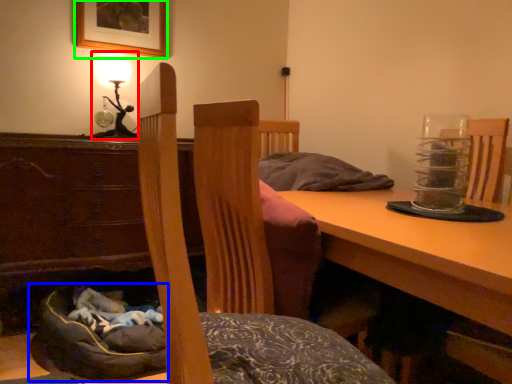
Question: Which object is positioned farthest from table lamp (highlighted by a red box)? Select from bean bag chair (highlighted by a blue box) and picture frame (highlighted by a green box).

Choices:
 (A) bean bag chair
 (B) picture frame

Answer: (A)